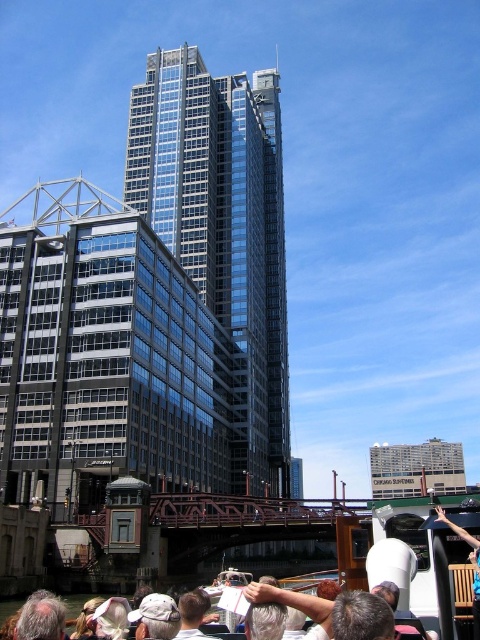
You are a photographer trying to capture the glassy steel skyscraper at center and the white fabric cap at lower center in the same frame. Which object should you zoom in on to ensure both fit in the photo?

The glassy steel skyscraper at center is wider than the white fabric cap at lower center. To fit both in the frame, you should zoom out slightly so that the wider skyscraper fits, allowing the smaller cap to also be included.

You are standing on the deck of the river cruise boat and want to take a photo of the glassy steel skyscraper at center. Where should you aim your camera to capture it?

The glassy steel skyscraper at center is located at point 0.364 on the x axis and 0.465 on the y axis, so you should aim your camera at those coordinates to capture it.